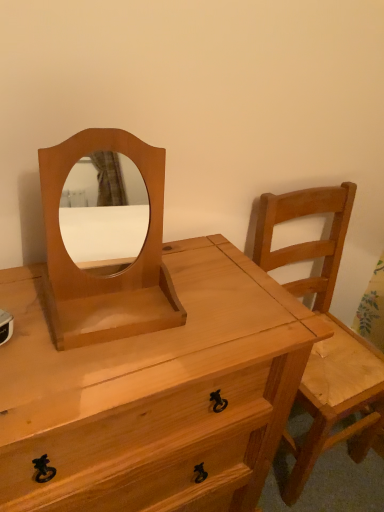
This screenshot has width=384, height=512. Identify the location of natural wood chest of drawers at center. (154, 394).

Identify the location of light brown wood mirror at center. (112, 274).

Find the location of a particular element. The height and width of the screenshot is (512, 384). natural wood chest of drawers at center is located at coordinates (154, 394).

Consider the image. Is natural wood chest of drawers at center not inside light brown wooden chair at right?

natural wood chest of drawers at center is positioned outside light brown wooden chair at right.

I want to click on chair behind the natural wood chest of drawers at center, so click(x=327, y=339).

Is natural wood chest of drawers at center in front of or behind light brown wooden chair at right in the image?

In the image, natural wood chest of drawers at center appears in front of light brown wooden chair at right.

Considering the points (223, 505) and (288, 218), which point is in front, point (223, 505) or point (288, 218)?

Point (223, 505)

From a real-world perspective, who is located lower, light brown wood mirror at center or natural wood chest of drawers at center?

natural wood chest of drawers at center, from a real-world perspective.

Visually, is light brown wood mirror at center positioned to the left or to the right of natural wood chest of drawers at center?

From the image, it's evident that light brown wood mirror at center is to the left of natural wood chest of drawers at center.

Is the surface of light brown wood mirror at center in direct contact with natural wood chest of drawers at center?

No, light brown wood mirror at center is not with natural wood chest of drawers at center.

Which of these two, light brown wood mirror at center or natural wood chest of drawers at center, stands taller?

natural wood chest of drawers at center is taller.

Is light brown wooden chair at right aimed at light brown wood mirror at center?

No, light brown wooden chair at right is not turned towards light brown wood mirror at center.

Is light brown wooden chair at right next to light brown wood mirror at center and touching it?

No, light brown wooden chair at right is not beside light brown wood mirror at center.

Is light brown wooden chair at right wider or thinner than light brown wood mirror at center?

In the image, light brown wooden chair at right appears to be wider than light brown wood mirror at center.

Can you tell me how much light brown wooden chair at right and light brown wood mirror at center differ in facing direction?

The angle between the facing direction of light brown wooden chair at right and the facing direction of light brown wood mirror at center is 4.21 degrees.

From a real-world perspective, is natural wood chest of drawers at center positioned above or below light brown wood mirror at center?

natural wood chest of drawers at center is below light brown wood mirror at center.

Is natural wood chest of drawers at center touching light brown wood mirror at center?

No.

Relative to light brown wood mirror at center, is natural wood chest of drawers at center in front or behind?

In the image, natural wood chest of drawers at center appears in front of light brown wood mirror at center.

This screenshot has height=512, width=384. I want to click on chair that appears below the light brown wood mirror at center (from the image's perspective), so click(327, 339).

From the image's perspective, is light brown wood mirror at center on light brown wooden chair at right?

Yes.

Based on the photo, can you tell me how much light brown wood mirror at center and light brown wooden chair at right differ in facing direction?

The angular difference between light brown wood mirror at center and light brown wooden chair at right is 4.21 degrees.

Is light brown wood mirror at center in contact with light brown wooden chair at right?

No.

You are a GUI agent. You are given a task and a screenshot of the screen. Output one action in this format:
    pyautogui.click(x=<x>, y=<y>)
    Task: Click on the chest of drawers below the light brown wooden chair at right (from the image's perspective)
    This screenshot has height=512, width=384.
    Given the screenshot: What is the action you would take?
    pyautogui.click(x=154, y=394)

From the image's perspective, which one is positioned higher, light brown wooden chair at right or natural wood chest of drawers at center?

light brown wooden chair at right.

In the image, is light brown wooden chair at right positioned in front of or behind natural wood chest of drawers at center?

Clearly, light brown wooden chair at right is behind natural wood chest of drawers at center.

Identify the location of chair above the natural wood chest of drawers at center (from the image's perspective). This screenshot has width=384, height=512. (327, 339).

Image resolution: width=384 pixels, height=512 pixels. I want to click on the chest of drawers lying in front of the light brown wood mirror at center, so click(154, 394).

When comparing their distances from natural wood chest of drawers at center, does light brown wood mirror at center or light brown wooden chair at right seem closer?

Based on the image, light brown wood mirror at center appears to be nearer to natural wood chest of drawers at center.

Which object lies nearer to the anchor point light brown wood mirror at center, light brown wooden chair at right or natural wood chest of drawers at center?

natural wood chest of drawers at center is positioned closer to the anchor light brown wood mirror at center.

When comparing their distances from light brown wooden chair at right, does light brown wood mirror at center or natural wood chest of drawers at center seem further?

light brown wood mirror at center lies further to light brown wooden chair at right than the other object.

Based on the photo, when comparing their distances from natural wood chest of drawers at center, does light brown wooden chair at right or light brown wood mirror at center seem further?

light brown wooden chair at right lies further to natural wood chest of drawers at center than the other object.

Which object lies further to the anchor point light brown wood mirror at center, natural wood chest of drawers at center or light brown wooden chair at right?

light brown wooden chair at right.

Considering their positions, is natural wood chest of drawers at center positioned further to light brown wooden chair at right than light brown wood mirror at center?

light brown wood mirror at center lies further to light brown wooden chair at right than the other object.

You are a GUI agent. You are given a task and a screenshot of the screen. Output one action in this format:
    pyautogui.click(x=<x>, y=<y>)
    Task: Click on the chest of drawers between light brown wood mirror at center and light brown wooden chair at right in the horizontal direction
    The height and width of the screenshot is (512, 384).
    Given the screenshot: What is the action you would take?
    pyautogui.click(x=154, y=394)